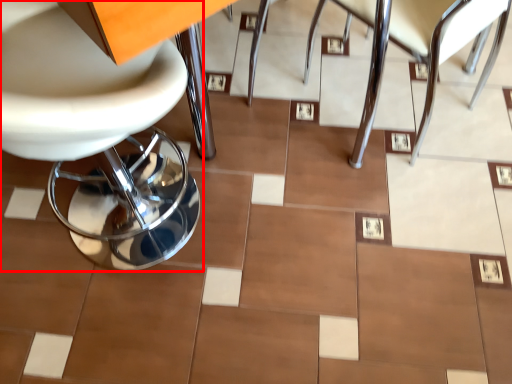
Question: From the image, what is the correct spatial relationship of chair (annotated by the red box) in relation to chair?

Choices:
 (A) left
 (B) right

Answer: (A)